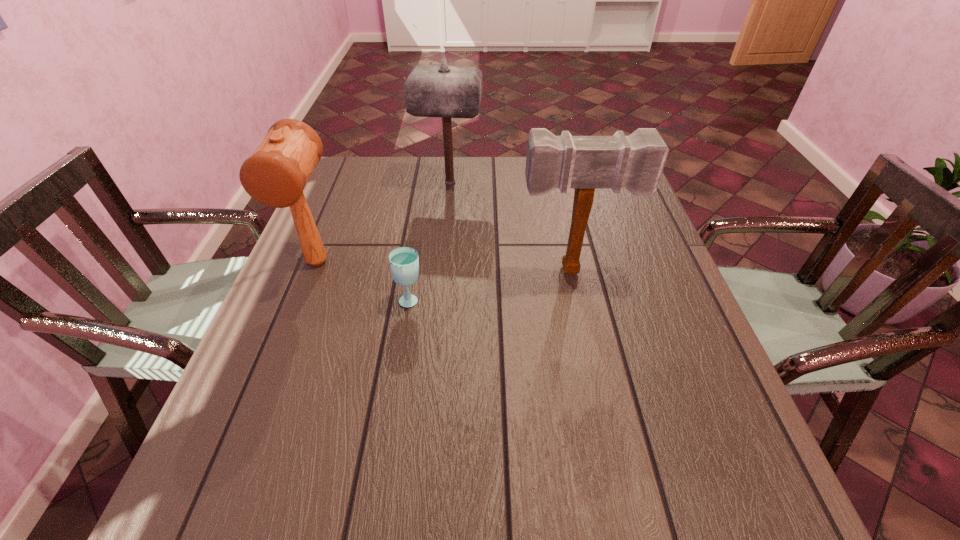
Locate which object is the second closest to the shortest object. Please provide its 2D coordinates. Your answer should be formatted as a tuple, i.e. [(x, y)], where the tuple contains the x and y coordinates of a point satisfying the conditions above.

[(635, 162)]

The height and width of the screenshot is (540, 960). What are the coordinates of `mallet that is the closest to the nearest object` in the screenshot? It's located at (275, 175).

Identify which mallet is the third nearest to the nearest object. Please provide its 2D coordinates. Your answer should be formatted as a tuple, i.e. [(x, y)], where the tuple contains the x and y coordinates of a point satisfying the conditions above.

[(444, 91)]

This screenshot has width=960, height=540. I want to click on vacant area that satisfies the following two spatial constraints: 1. on the strike surface of the rightmost mallet; 2. on the left side of the leftmost object, so click(314, 270).

You are a GUI agent. You are given a task and a screenshot of the screen. Output one action in this format:
    pyautogui.click(x=<x>, y=<y>)
    Task: Click on the free location that satisfies the following two spatial constraints: 1. on the back side of the glass; 2. on the left side of the second mallet from right to left
    
    Given the screenshot: What is the action you would take?
    pyautogui.click(x=428, y=182)

Find the location of `free region that satisfies the following two spatial constraints: 1. on the strike surface of the leftmost mallet; 2. on the right side of the glass`. free region that satisfies the following two spatial constraints: 1. on the strike surface of the leftmost mallet; 2. on the right side of the glass is located at coordinates (302, 299).

Find the location of a particular element. Image resolution: width=960 pixels, height=540 pixels. vacant point that satisfies the following two spatial constraints: 1. on the strike surface of the leftmost object; 2. on the left side of the rightmost object is located at coordinates (314, 270).